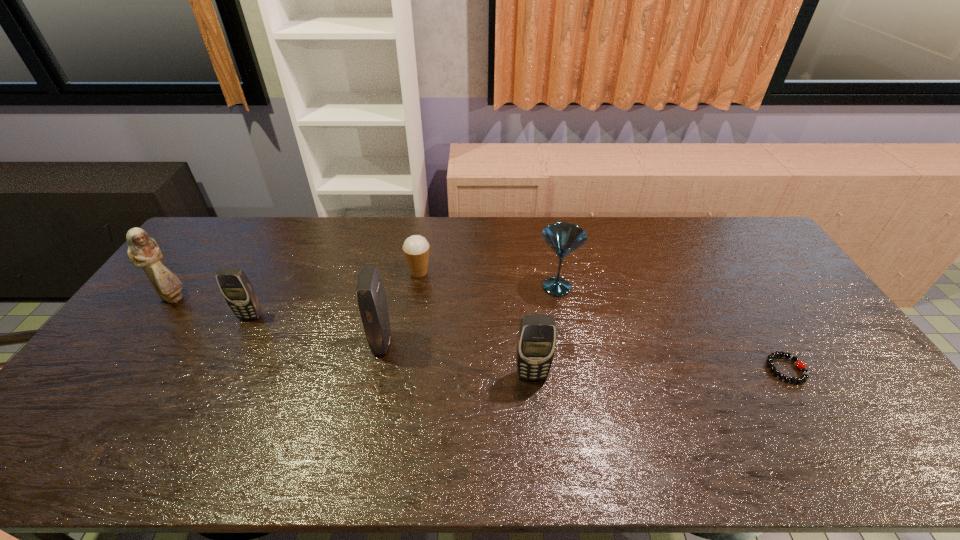
Where is `object present at the left edge`? object present at the left edge is located at coordinates (143, 251).

The width and height of the screenshot is (960, 540). In order to click on object that is at the right edge in this screenshot , I will do `click(805, 373)`.

This screenshot has width=960, height=540. Identify the location of vacant area at the far edge of the desktop. (641, 234).

In order to click on free spot at the near edge of the desktop in this screenshot , I will do `click(516, 409)`.

Locate an element on the screen. vacant space at the left edge is located at coordinates (181, 301).

This screenshot has width=960, height=540. I want to click on free space at the right edge of the desktop, so click(x=734, y=267).

Where is `vacant space at the near right corner of the desktop`? Image resolution: width=960 pixels, height=540 pixels. vacant space at the near right corner of the desktop is located at coordinates (848, 420).

This screenshot has width=960, height=540. I want to click on vacant area between the leftmost cellular telephone and the leftmost object, so click(212, 307).

The height and width of the screenshot is (540, 960). I want to click on vacant space in between the leftmost cellular telephone and the third object from left to right, so click(x=317, y=330).

Locate an element on the screen. The height and width of the screenshot is (540, 960). vacant space that is in between the shortest cellular telephone and the sixth tallest object is located at coordinates (335, 294).